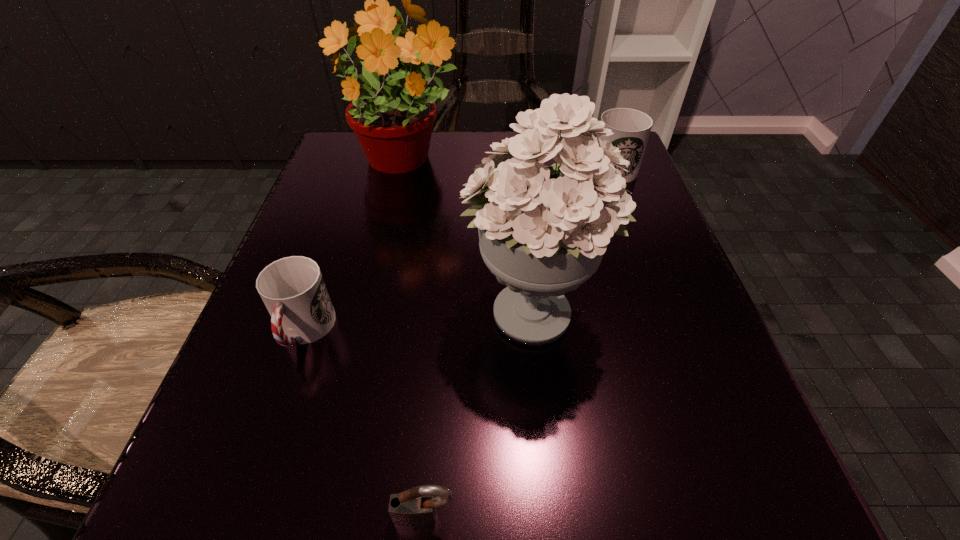
Where is `object present at the far left corner`? This screenshot has width=960, height=540. object present at the far left corner is located at coordinates (393, 125).

The height and width of the screenshot is (540, 960). I want to click on object present at the far right corner, so click(x=631, y=128).

In order to click on vacant space at the far edge of the desktop in this screenshot , I will do `click(444, 150)`.

Find the location of a particular element. This screenshot has width=960, height=540. blank space at the near edge is located at coordinates (466, 528).

Identify the location of vacant point at the left edge. This screenshot has height=540, width=960. tap(299, 237).

Find the location of a particular element. vacant space at the right edge is located at coordinates (707, 391).

This screenshot has height=540, width=960. Identify the location of vacant region at the far left corner of the desktop. (322, 181).

At what (x,y) coordinates should I click in order to perform the action: click on free spot at the near right corner of the desktop. Please return your answer as a coordinate pair (x, y). The height and width of the screenshot is (540, 960). Looking at the image, I should click on (684, 478).

Where is `empty space between the third shortest object and the nearest object`? The image size is (960, 540). empty space between the third shortest object and the nearest object is located at coordinates (515, 343).

Locate an element on the screen. free spot between the flowerpot and the nearest object is located at coordinates (414, 340).